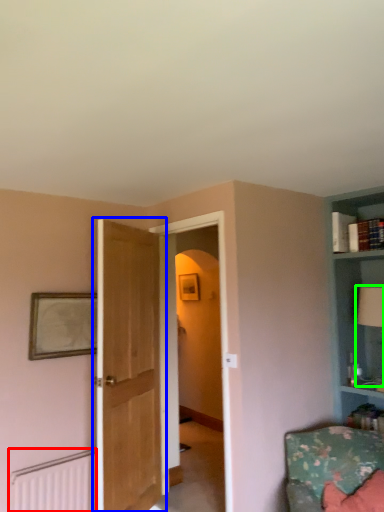
Question: Which object is positioned closest to radiator (highlighted by a red box)? Select from door (highlighted by a blue box) and table lamp (highlighted by a green box).

Choices:
 (A) door
 (B) table lamp

Answer: (A)